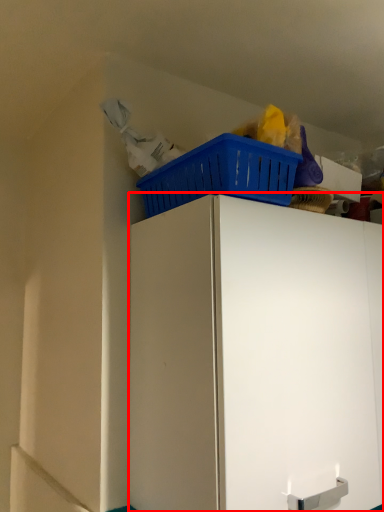
Question: From the image's perspective, considering the relative positions of cabinetry (annotated by the red box) and basket in the image provided, where is cabinetry (annotated by the red box) located with respect to the staircase?

Choices:
 (A) above
 (B) below

Answer: (B)